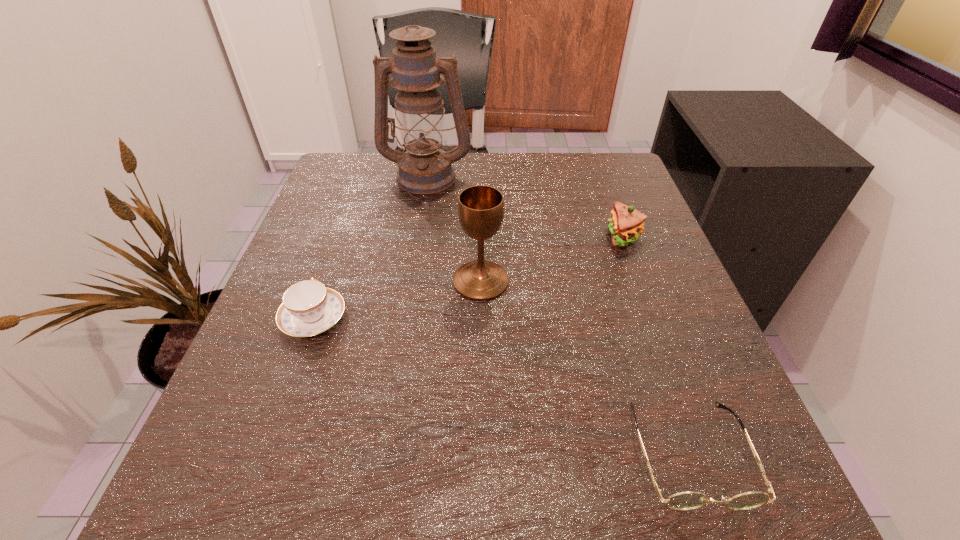
At what (x,y) coordinates should I click in order to perform the action: click on object at the far left corner. Please return your answer as a coordinate pair (x, y). Image resolution: width=960 pixels, height=540 pixels. Looking at the image, I should click on (425, 169).

Find the location of a particular element. The width and height of the screenshot is (960, 540). object located in the near right corner section of the desktop is located at coordinates (685, 500).

You are a GUI agent. You are given a task and a screenshot of the screen. Output one action in this format:
    pyautogui.click(x=<x>, y=<y>)
    Task: Click on the vacant space at the far edge
    This screenshot has height=540, width=960.
    Given the screenshot: What is the action you would take?
    pyautogui.click(x=444, y=195)

Locate an element on the screen. The height and width of the screenshot is (540, 960). vacant region at the near edge of the desktop is located at coordinates (629, 500).

Find the location of a particular element. This screenshot has height=540, width=960. vacant point at the left edge is located at coordinates (243, 361).

At what (x,y) coordinates should I click in order to perform the action: click on free spot at the right edge of the desktop. Please return your answer as a coordinate pair (x, y). This screenshot has height=540, width=960. Looking at the image, I should click on (682, 446).

Locate an element on the screen. The width and height of the screenshot is (960, 540). vacant region at the far left corner of the desktop is located at coordinates (377, 163).

Image resolution: width=960 pixels, height=540 pixels. Find the location of `vacant space at the near left corner of the desktop`. vacant space at the near left corner of the desktop is located at coordinates (214, 456).

The image size is (960, 540). In the image, there is a desktop. Find the location of `vacant space at the far right corner`. vacant space at the far right corner is located at coordinates (586, 153).

In the image, there is a desktop. Where is `vacant space at the near right corner`? This screenshot has width=960, height=540. vacant space at the near right corner is located at coordinates (740, 475).